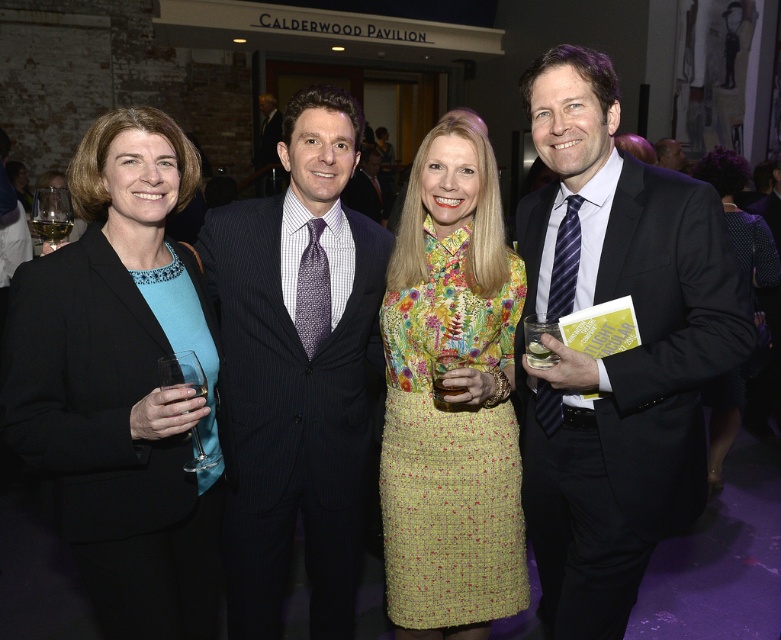
Question: Which point is closer to the camera taking this photo?

Choices:
 (A) (762, 284)
 (B) (490, 220)
 (C) (680, 161)
 (D) (551, 461)

Answer: (D)

Question: Is black suit at right thinner than floral fabric dress at center?

Choices:
 (A) yes
 (B) no

Answer: (B)

Question: Which point is farther from the camera taking this photo?

Choices:
 (A) (548, 474)
 (B) (658, 145)
 (C) (394, 310)
 (D) (104, 438)

Answer: (B)

Question: Can you confirm if black suit at right is bigger than black fabric blazer at left?

Choices:
 (A) no
 (B) yes

Answer: (B)

Question: Among these objects, which one is farthest from the camera?

Choices:
 (A) floral fabric dress at center
 (B) black suit at right
 (C) dark blue pinstripe suit at center
 (D) black fabric blazer at left

Answer: (C)

Question: Is black suit at right to the right of matte black suit at center from the viewer's perspective?

Choices:
 (A) no
 (B) yes

Answer: (A)